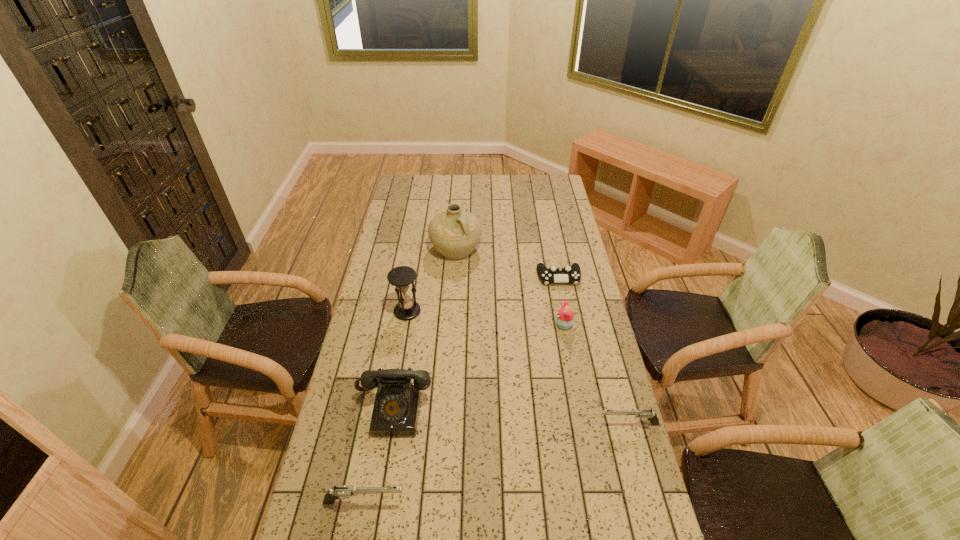
Please point a space for a new pistol to maintain equal intervals. Please provide its 2D coordinates. Your answer should be formatted as a tuple, i.e. [(x, y)], where the tuple contains the x and y coordinates of a point satisfying the conditions above.

[(506, 460)]